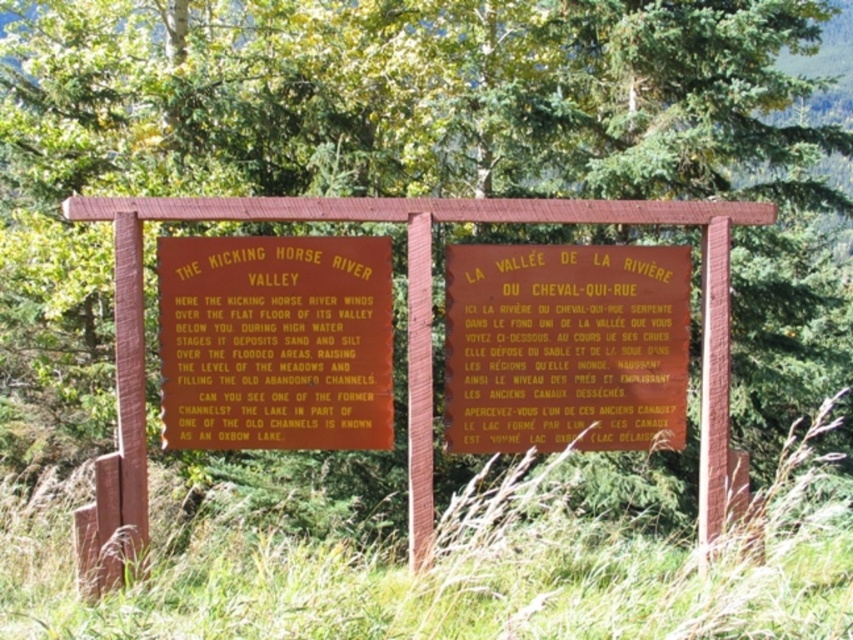
Question: Among these objects, which one is farthest from the camera?

Choices:
 (A) matte orange sign at center
 (B) green grass at lower center
 (C) yellow paper sign at center

Answer: (C)

Question: Estimate the real-world distances between objects in this image. Which object is farther from the matte orange sign at center?

Choices:
 (A) green grass at lower center
 (B) yellow paper sign at center

Answer: (A)

Question: Among these points, which one is nearest to the camera?

Choices:
 (A) (778, 634)
 (B) (281, 404)

Answer: (A)

Question: Is green grass at lower center smaller than yellow paper sign at center?

Choices:
 (A) yes
 (B) no

Answer: (B)

Question: Is green grass at lower center behind yellow paper sign at center?

Choices:
 (A) no
 (B) yes

Answer: (A)

Question: Does green grass at lower center lie behind yellow paper sign at center?

Choices:
 (A) yes
 (B) no

Answer: (B)